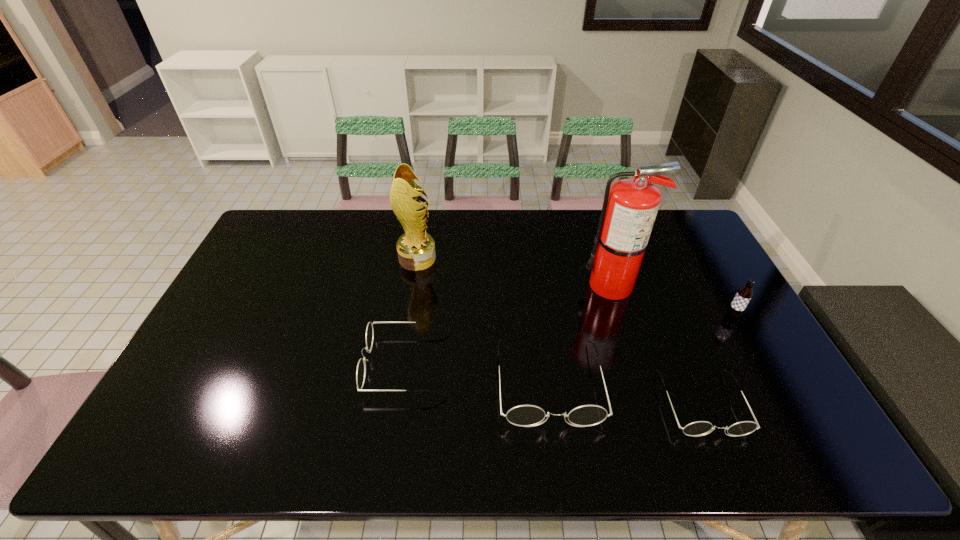
The width and height of the screenshot is (960, 540). I want to click on vacant area situated 0.190m on the front-facing side of the fifth tallest object, so click(295, 364).

Find the location of a particular element. free space located 0.130m on the front-facing side of the fifth tallest object is located at coordinates (317, 364).

What are the coordinates of `vacant space positioned 0.250m on the back of the root beer` in the screenshot? It's located at (700, 257).

The height and width of the screenshot is (540, 960). I want to click on vacant area located at the nozzle of the fire extinguisher, so click(x=550, y=286).

This screenshot has width=960, height=540. I want to click on vacant space located at the nozzle of the fire extinguisher, so click(x=491, y=286).

Find the location of `blank space located 0.100m at the nozzle of the fire extinguisher`. blank space located 0.100m at the nozzle of the fire extinguisher is located at coordinates (550, 286).

The height and width of the screenshot is (540, 960). I want to click on free space located 0.050m on the front-facing side of the fifth shortest object, so click(x=450, y=259).

The image size is (960, 540). I want to click on object that is at the far edge, so click(416, 249).

At what (x,y) coordinates should I click in order to perform the action: click on spectacles present at the right edge. Please return your answer as a coordinate pair (x, y). This screenshot has width=960, height=540. Looking at the image, I should click on (700, 428).

Image resolution: width=960 pixels, height=540 pixels. What are the coordinates of `root beer that is at the right edge` in the screenshot? It's located at (744, 294).